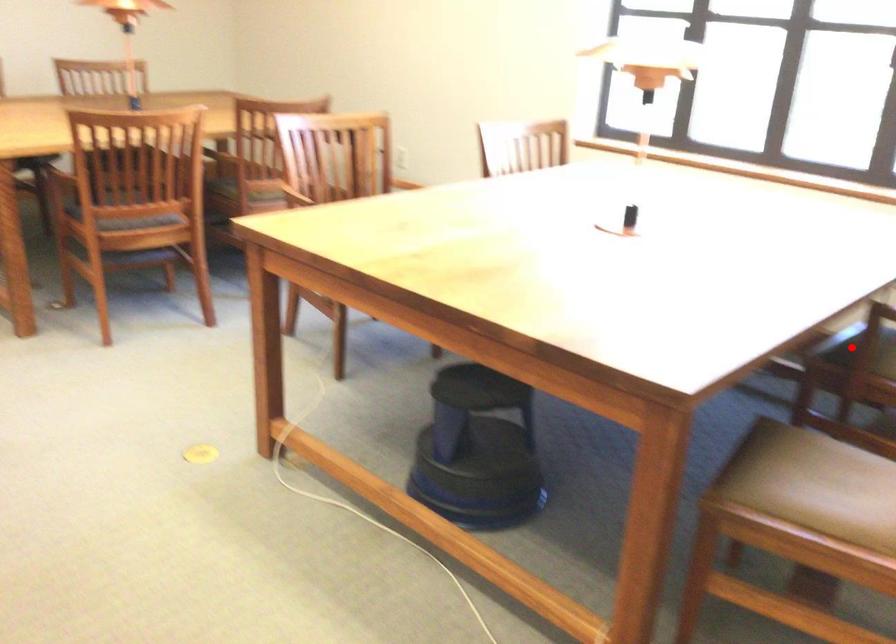
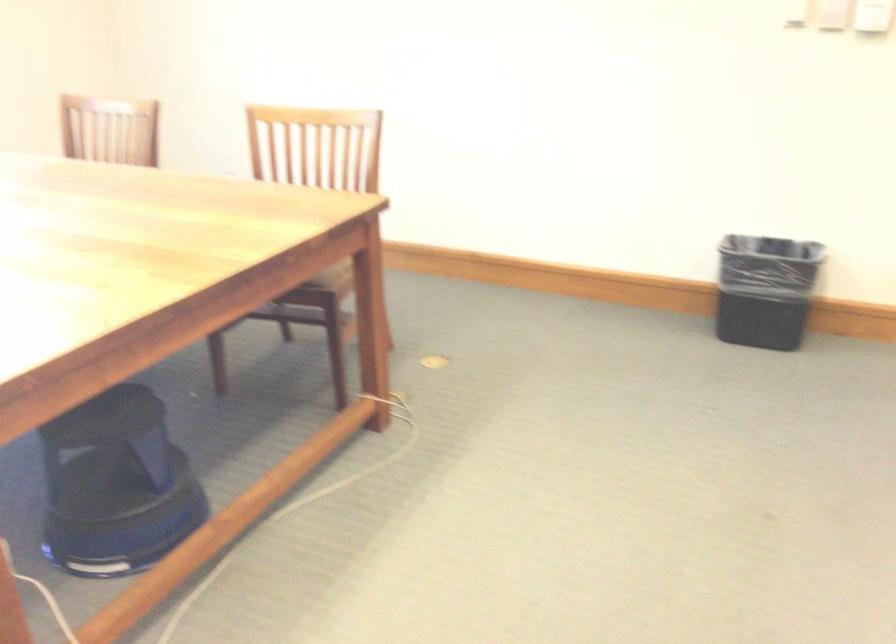
Question: I am providing you with two images of the same scene from different viewpoints. A red point is marked on the first image. At the location where the point appears in image 1, is it still visible in image 2?

Choices:
 (A) Yes
 (B) No

Answer: (B)